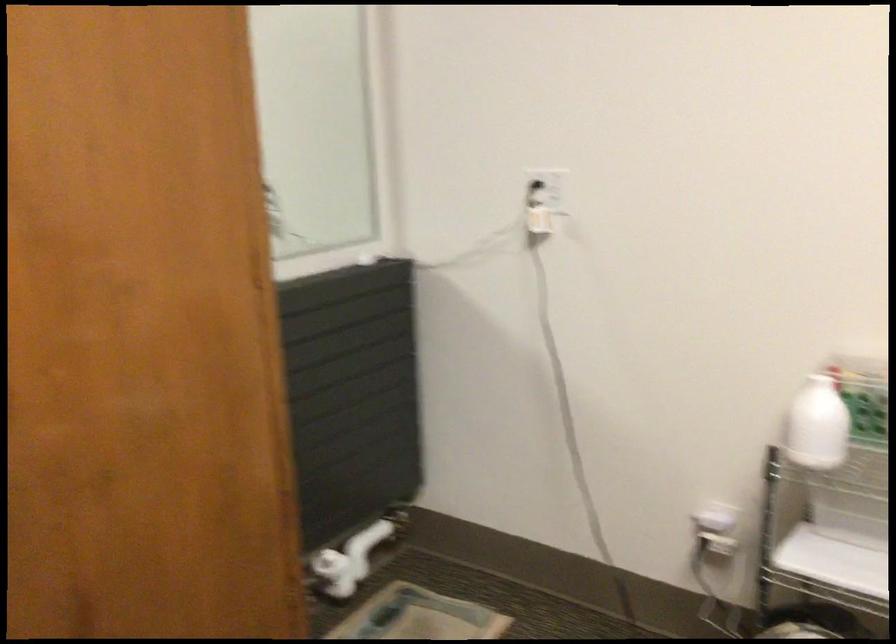
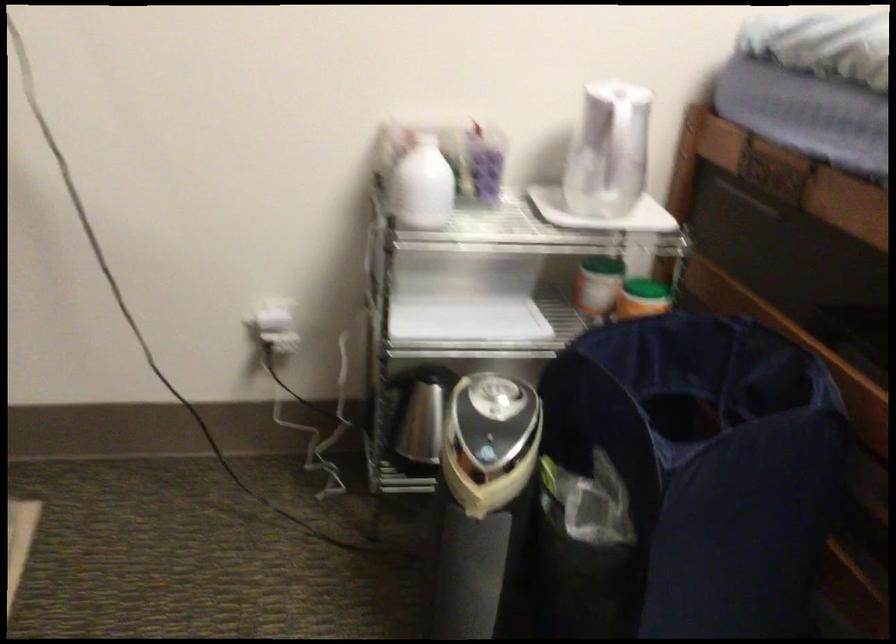
The point at (810, 428) is marked in the first image. Where is the corresponding point in the second image?

(421, 185)